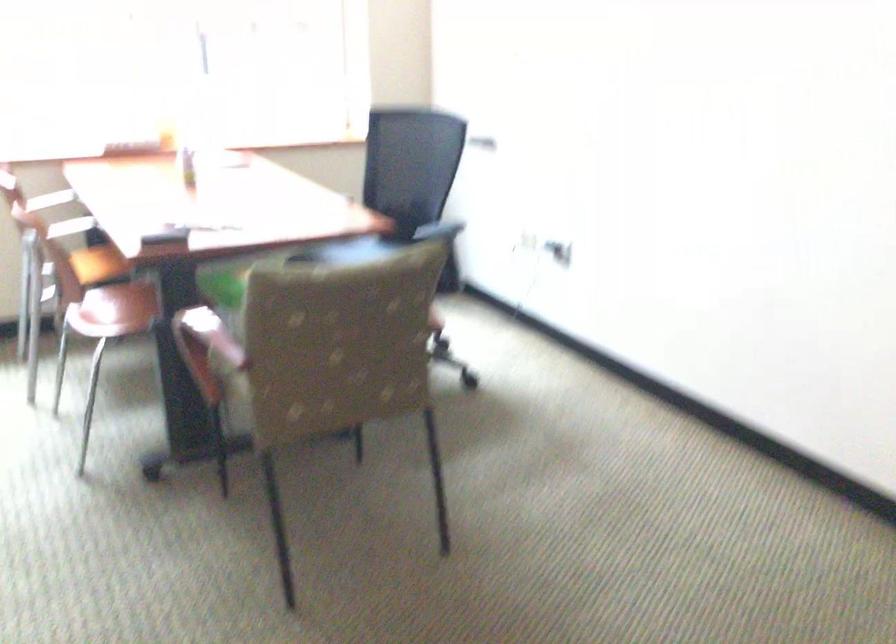
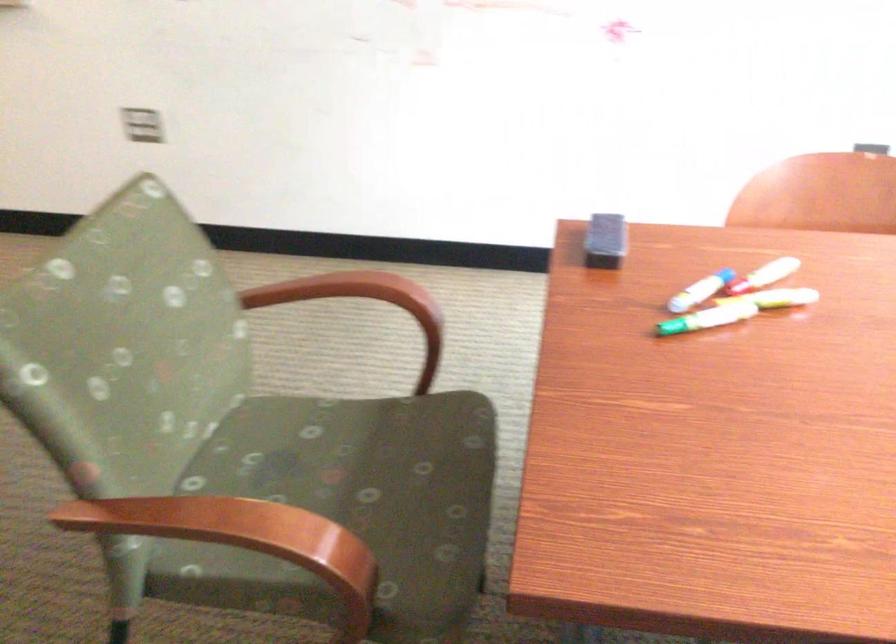
Where in the second image is the point corresponding to point 168,210 from the first image?

(773, 270)